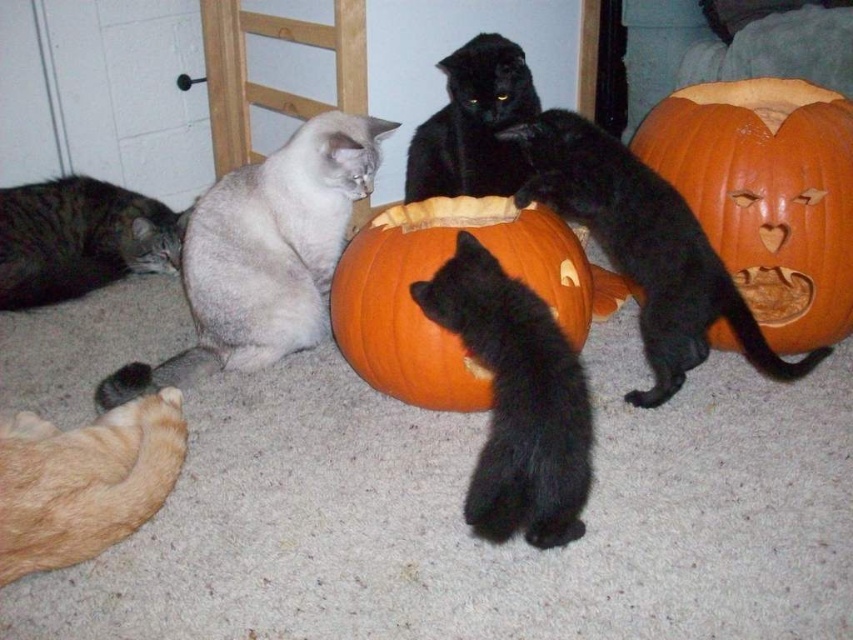
Looking at this image, you have a toy mouse that is 12 inches long. You want to place it between the silvery fur cat at center and the black matte cat at upper center so that both cats can play with it simultaneously. Is the space between them sufficient for the toy mouse to fit without overlapping either cat?

The distance between the silvery fur cat at center and the black matte cat at upper center is 15.12 inches. Since the toy mouse is 12 inches long, there is enough space to place it between them without overlapping either cat.

Consider the image. You are a cat owner trying to locate your pumpkin decoration in the living room. Where is the orange matte pumpkin at center positioned in the room?

The orange matte pumpkin at center is located at the coordinates 0.431 on the x and 0.506 on the y axis.

You are a cat owner who wants to ensure your black fur cat at center has enough space to move around without bumping into the orange matte pumpkin at center. Based on the scene, can you confirm if the pumpkin is positioned in a way that might obstruct the cat?

The orange matte pumpkin at center is above the black fur cat at center, so it is placed in a position that does not block the cat from moving freely on the floor. The cat should have enough space to move around without obstruction.